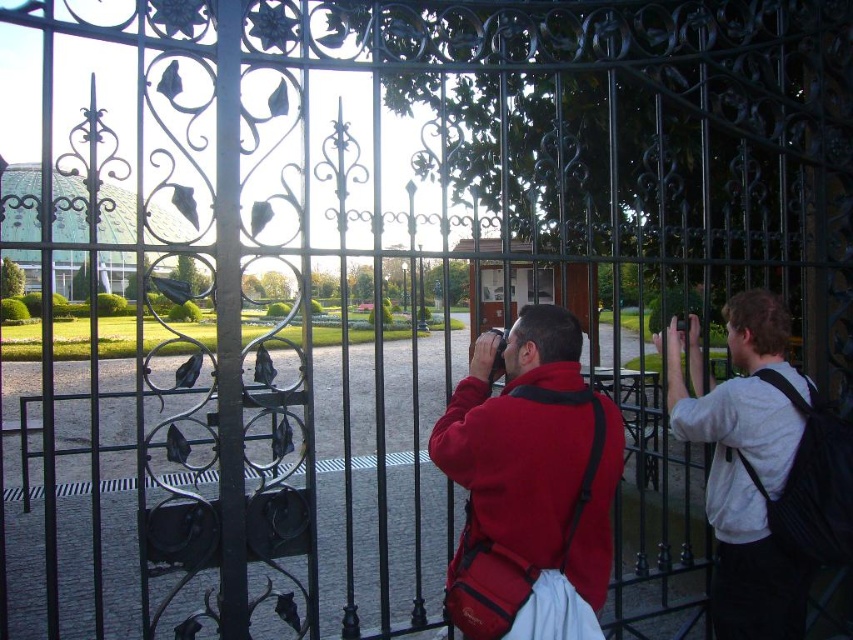
Is matte red jacket at center positioned behind white fabric at right?

No.

Between matte red jacket at center and white fabric at right, which one has more height?

Standing taller between the two is matte red jacket at center.

Where is `matte red jacket at center`? matte red jacket at center is located at coordinates [x=531, y=484].

Describe the element at coordinates (531, 484) in the screenshot. I see `matte red jacket at center` at that location.

Can you confirm if matte red jacket at center is positioned below metallic glass door at center?

Yes, matte red jacket at center is below metallic glass door at center.

Between point (468, 554) and point (486, 285), which one is positioned in front?

Point (468, 554)

Identify the location of matte red jacket at center. (531, 484).

Based on the photo, who is shorter, white fabric at right or metallic glass door at center?

With less height is white fabric at right.

Is white fabric at right smaller than metallic glass door at center?

Correct, white fabric at right occupies less space than metallic glass door at center.

The width and height of the screenshot is (853, 640). I want to click on white fabric at right, so click(744, 465).

At what (x,y) coordinates should I click in order to perform the action: click on white fabric at right. Please return your answer as a coordinate pair (x, y). Looking at the image, I should click on (744, 465).